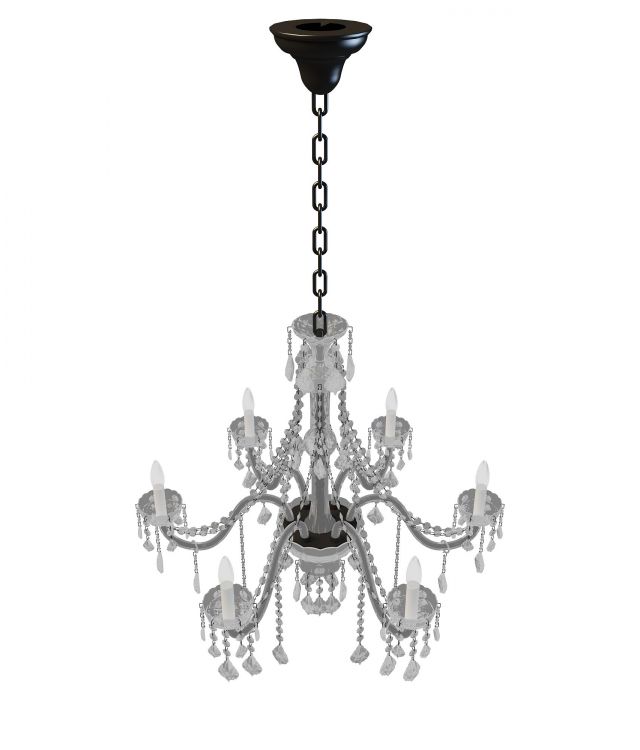
You are a GUI agent. You are given a task and a screenshot of the screen. Output one action in this format:
    pyautogui.click(x=<x>, y=<y>)
    Task: Click on the long hanging crystals
    
    Given the screenshot: What is the action you would take?
    pyautogui.click(x=282, y=654), pyautogui.click(x=356, y=656)